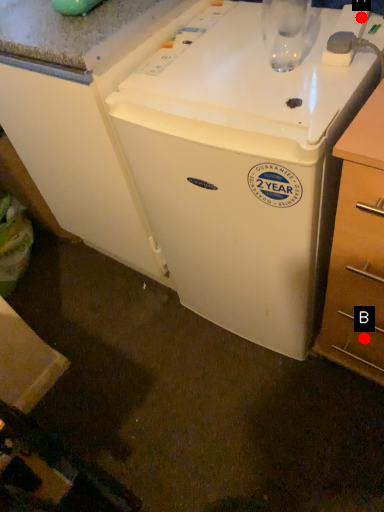
Question: Two points are circled on the image, labeled by A and B beside each circle. Which of the following is the closest to the observer?

Choices:
 (A) A is closer
 (B) B is closer

Answer: (A)